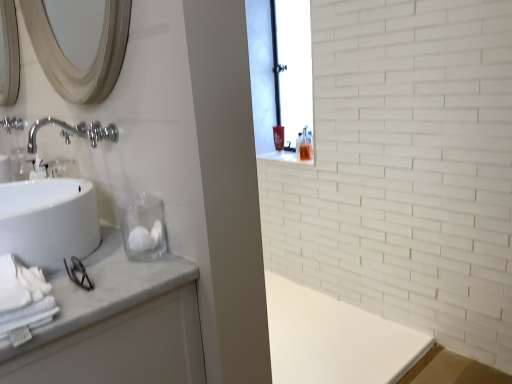
Question: Can you confirm if white glossy sink at left is shorter than silver metallic mirror at upper left?

Choices:
 (A) yes
 (B) no

Answer: (A)

Question: Does white glossy sink at left come in front of silver metallic mirror at upper left?

Choices:
 (A) yes
 (B) no

Answer: (B)

Question: From a real-world perspective, does white glossy sink at left sit lower than silver metallic mirror at upper left?

Choices:
 (A) no
 (B) yes

Answer: (B)

Question: Are white glossy sink at left and silver metallic mirror at upper left beside each other?

Choices:
 (A) yes
 (B) no

Answer: (B)

Question: Can you confirm if white glossy sink at left is smaller than silver metallic mirror at upper left?

Choices:
 (A) yes
 (B) no

Answer: (B)

Question: From the image's perspective, does white glossy sink at left appear higher than silver metallic mirror at upper left?

Choices:
 (A) no
 (B) yes

Answer: (A)

Question: Is silver metallic mirror at upper left far from chrome metallic faucet at upper left, placed as the 2th plumbing fixture when sorted from bottom to top?

Choices:
 (A) yes
 (B) no

Answer: (B)

Question: Can you confirm if silver metallic mirror at upper left is smaller than chrome metallic faucet at upper left, the first plumbing fixture viewed from the back?

Choices:
 (A) yes
 (B) no

Answer: (B)

Question: Does silver metallic mirror at upper left have a lesser height compared to chrome metallic faucet at upper left, acting as the first plumbing fixture starting from the left?

Choices:
 (A) no
 (B) yes

Answer: (A)

Question: Is silver metallic mirror at upper left located outside chrome metallic faucet at upper left, acting as the first plumbing fixture starting from the left?

Choices:
 (A) no
 (B) yes

Answer: (B)

Question: From a real-world perspective, is silver metallic mirror at upper left physically above chrome metallic faucet at upper left, the first plumbing fixture viewed from the back?

Choices:
 (A) yes
 (B) no

Answer: (A)

Question: From a real-world perspective, is silver metallic mirror at upper left below chrome metallic faucet at upper left, placed as the 2th plumbing fixture when sorted from bottom to top?

Choices:
 (A) no
 (B) yes

Answer: (A)

Question: From the image's perspective, is chrome metallic faucet at upper left, acting as the first plumbing fixture starting from the left, located beneath white glossy sink at left?

Choices:
 (A) yes
 (B) no

Answer: (B)